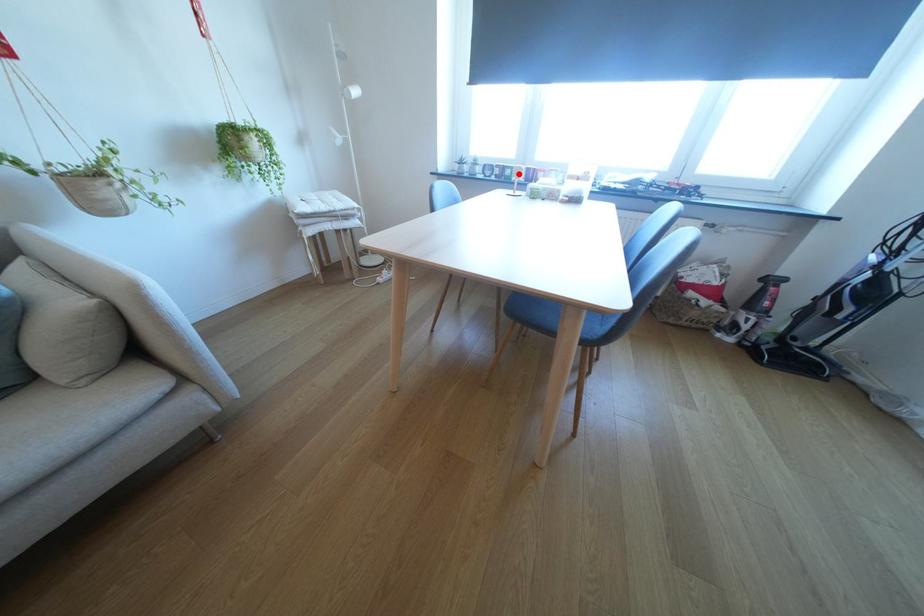
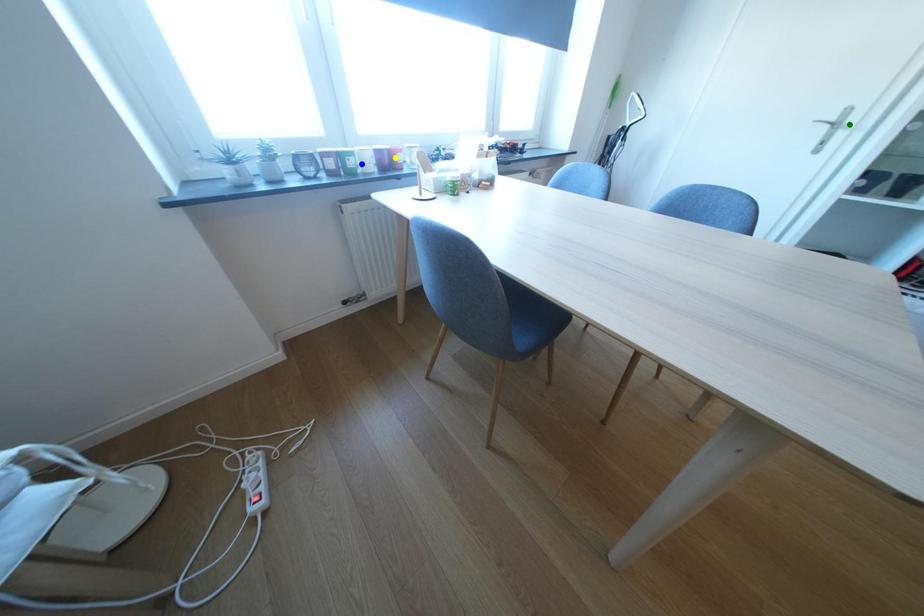
Question: I am providing you with two images of the same scene from different viewpoints. A red point is marked on the first image. You are given multiple points on the second image. Can you choose the point in image 2 that corresponds to the point in image 1?

Choices:
 (A) yellow point
 (B) blue point
 (C) green point

Answer: (B)